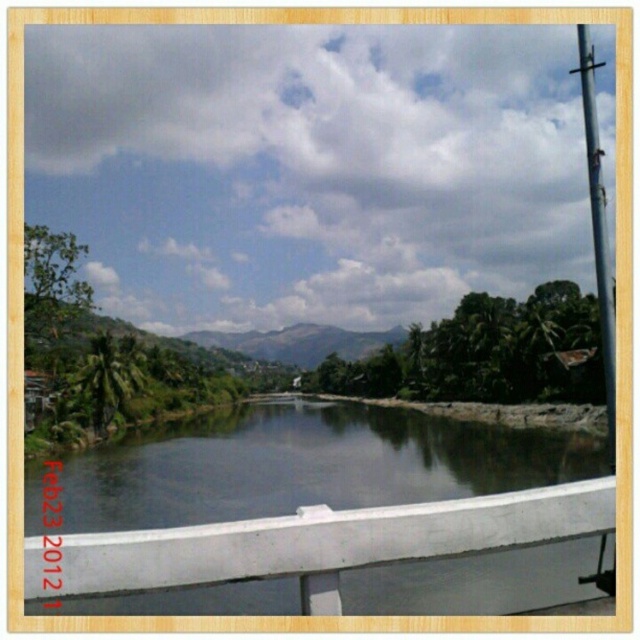
Question: Can you confirm if clear water at center is thinner than metallic pole at right?

Choices:
 (A) no
 (B) yes

Answer: (B)

Question: Is clear water at center below metallic pole at right?

Choices:
 (A) yes
 (B) no

Answer: (A)

Question: Can you confirm if clear water at center is positioned above metallic pole at right?

Choices:
 (A) no
 (B) yes

Answer: (A)

Question: Among these objects, which one is nearest to the camera?

Choices:
 (A) metallic pole at right
 (B) clear water at center

Answer: (B)

Question: Which object appears closest to the camera in this image?

Choices:
 (A) clear water at center
 (B) metallic pole at right

Answer: (A)